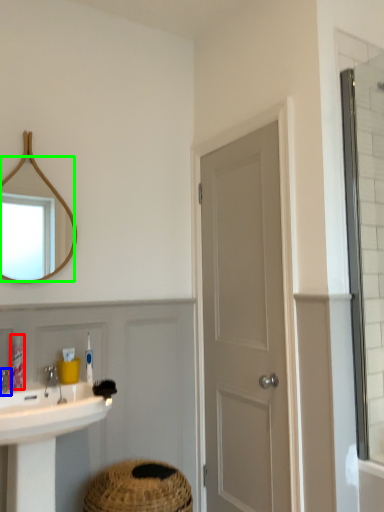
Question: Based on their relative distances, which object is farther from toiletry (highlighted by a red box)? Choose from tap (highlighted by a blue box) and mirror (highlighted by a green box).

Choices:
 (A) tap
 (B) mirror

Answer: (B)